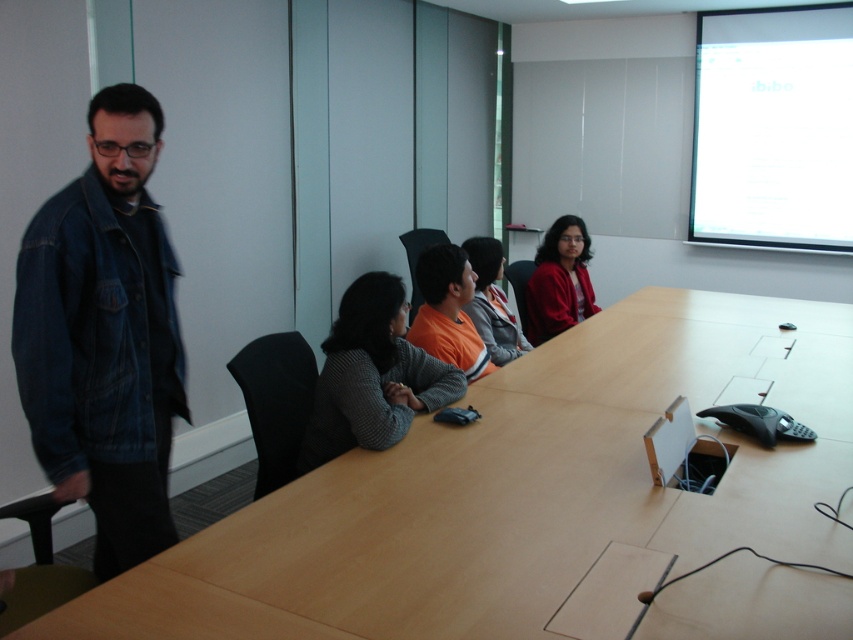
You are sitting at the conference table in the meeting room. There are two points marked on the table, point 1 at coordinates (x=430, y=305) and point 2 at (x=508, y=358). If you need to move an object from point 2 to a position closer to you, where should you place it relative to point 1?

Point 1 at coordinates (x=430, y=305) is already in front of point 2 at (x=508, y=358). Therefore, moving the object to point 1 would place it closer to you.

You are organizing a charity event and need to decide which orange garment to donate. Both the orange cotton shirt at center and the orange fleece jacket at center are available. Based on their sizes, which one is more suitable for a child?

The orange cotton shirt at center has a smaller size compared to the orange fleece jacket at center, so it is more suitable for a child.